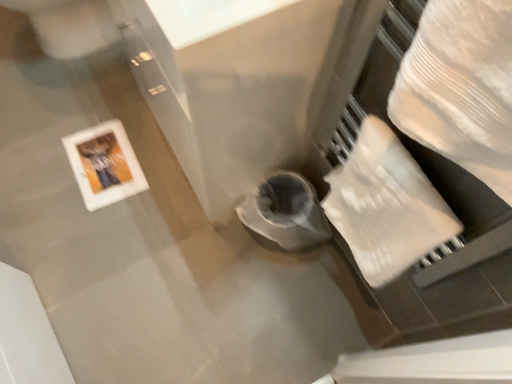
Locate an element on the screen. Image resolution: width=512 pixels, height=384 pixels. white glossy picture frame at upper left is located at coordinates (104, 164).

Describe the element at coordinates (104, 164) in the screenshot. I see `white glossy picture frame at upper left` at that location.

You are a GUI agent. You are given a task and a screenshot of the screen. Output one action in this format:
    pyautogui.click(x=<x>, y=<y>)
    Task: Click on the white textured toilet paper at right
    
    Given the screenshot: What is the action you would take?
    pyautogui.click(x=386, y=205)

Describe the element at coordinates (386, 205) in the screenshot. I see `white textured toilet paper at right` at that location.

What is the approximate width of white textured toilet paper at right?

white textured toilet paper at right is 3.20 inches in width.

From the picture: In order to face white textured toilet paper at right, should I rotate leftwards or rightwards?

A 16.636 degree turn to the right will do.

The width and height of the screenshot is (512, 384). I want to click on white glossy picture frame at upper left, so click(104, 164).

Looking at this image, is white glossy picture frame at upper left at the left side of white textured toilet paper at right?

Correct, you'll find white glossy picture frame at upper left to the left of white textured toilet paper at right.

Which object is more forward, white glossy picture frame at upper left or white textured toilet paper at right?

white textured toilet paper at right is in front.

Is point (117, 172) closer or farther from the camera than point (372, 172)?

Clearly, point (117, 172) is more distant from the camera than point (372, 172).

From the image's perspective, would you say white glossy picture frame at upper left is positioned over white textured toilet paper at right?

Yes, from the image's perspective, white glossy picture frame at upper left is above white textured toilet paper at right.

From a real-world perspective, which object stands above the other?

white textured toilet paper at right, from a real-world perspective.

In the scene shown: Between white glossy picture frame at upper left and white textured toilet paper at right, which one has larger width?

With larger width is white glossy picture frame at upper left.

Is white glossy picture frame at upper left taller than white textured toilet paper at right?

No.

In terms of size, does white glossy picture frame at upper left appear bigger or smaller than white textured toilet paper at right?

Clearly, white glossy picture frame at upper left is smaller in size than white textured toilet paper at right.

Is white glossy picture frame at upper left not within white textured toilet paper at right?

Yes, white glossy picture frame at upper left is not within white textured toilet paper at right.

Are white glossy picture frame at upper left and white textured toilet paper at right beside each other?

No, white glossy picture frame at upper left is not beside white textured toilet paper at right.

Is white glossy picture frame at upper left oriented towards white textured toilet paper at right?

No, white glossy picture frame at upper left is not oriented towards white textured toilet paper at right.

Image resolution: width=512 pixels, height=384 pixels. In order to click on toilet paper below the white glossy picture frame at upper left (from the image's perspective) in this screenshot , I will do `click(386, 205)`.

Looking at this image, considering the relative positions of white textured toilet paper at right and white glossy picture frame at upper left in the image provided, is white textured toilet paper at right to the left of white glossy picture frame at upper left from the viewer's perspective?

No.

In the image, is white textured toilet paper at right positioned in front of or behind white glossy picture frame at upper left?

white textured toilet paper at right is in front of white glossy picture frame at upper left.

Is point (357, 155) farther from camera compared to point (89, 183)?

No, it is not.

From the image's perspective, is white textured toilet paper at right positioned above or below white glossy picture frame at upper left?

From the image's perspective, white textured toilet paper at right appears below white glossy picture frame at upper left.

From a real-world perspective, is white textured toilet paper at right above or below white glossy picture frame at upper left?

From a real-world perspective, white textured toilet paper at right is physically above white glossy picture frame at upper left.

Does white textured toilet paper at right have a lesser width compared to white glossy picture frame at upper left?

Yes.

Does white textured toilet paper at right have a greater height compared to white glossy picture frame at upper left?

Indeed, white textured toilet paper at right has a greater height compared to white glossy picture frame at upper left.

Considering the sizes of objects white textured toilet paper at right and white glossy picture frame at upper left in the image provided, who is bigger, white textured toilet paper at right or white glossy picture frame at upper left?

With larger size is white textured toilet paper at right.

Which is correct: white textured toilet paper at right is inside white glossy picture frame at upper left, or outside of it?

The correct answer is: outside.

Is white textured toilet paper at right far from white glossy picture frame at upper left?

white textured toilet paper at right is near white glossy picture frame at upper left, not far away.

Based on the photo, is white textured toilet paper at right turned away from white glossy picture frame at upper left?

No, white glossy picture frame at upper left is not at the back of white textured toilet paper at right.

Measure the distance between white textured toilet paper at right and white glossy picture frame at upper left.

33.81 inches.

Locate an element on the screen. The image size is (512, 384). picture frame above the white textured toilet paper at right (from the image's perspective) is located at coordinates (104, 164).

Where is `toilet paper that is on the right side of white glossy picture frame at upper left`? toilet paper that is on the right side of white glossy picture frame at upper left is located at coordinates click(x=386, y=205).

This screenshot has height=384, width=512. Find the location of `toilet paper that appears in front of the white glossy picture frame at upper left`. toilet paper that appears in front of the white glossy picture frame at upper left is located at coordinates (386, 205).